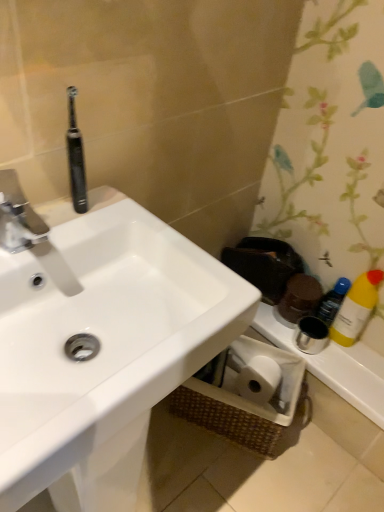
Where is `blue plastic bottle at lower right`? This screenshot has width=384, height=512. blue plastic bottle at lower right is located at coordinates (332, 301).

Where is `yellow plastic bottle at right`? yellow plastic bottle at right is located at coordinates (356, 308).

Where is `blue plastic bottle at lower right`? The image size is (384, 512). blue plastic bottle at lower right is located at coordinates (332, 301).

Does yellow plastic bottle at right appear on the left side of blue plastic bottle at lower right?

No.

Find the location of a particular element. The image size is (384, 512). bottle below the yellow plastic bottle at right (from a real-world perspective) is located at coordinates [x=332, y=301].

Considering the relative sizes of yellow plastic bottle at right and blue plastic bottle at lower right in the image provided, is yellow plastic bottle at right thinner than blue plastic bottle at lower right?

No, yellow plastic bottle at right is not thinner than blue plastic bottle at lower right.

From a real-world perspective, which object rests below the other?

blue plastic bottle at lower right is physically lower.

From the image's perspective, is white glossy sink at upper left located above or below blue plastic bottle at lower right?

white glossy sink at upper left is situated lower than blue plastic bottle at lower right in the image.

From a real-world perspective, which object stands above the other?

white glossy sink at upper left.

Considering the sizes of objects white glossy sink at upper left and blue plastic bottle at lower right in the image provided, who is shorter, white glossy sink at upper left or blue plastic bottle at lower right?

blue plastic bottle at lower right is shorter.

In terms of width, does white glossy sink at upper left look wider or thinner when compared to blue plastic bottle at lower right?

white glossy sink at upper left is wider than blue plastic bottle at lower right.

Between point (345, 376) and point (86, 197), which one is positioned behind?

The point (345, 376) is farther.

Which of these two, white plastic toilet paper holder at lower right or black rubber toothbrush at upper left, is smaller?

black rubber toothbrush at upper left is smaller.

Where is `counter top that is under the black rubber toothbrush at upper left (from a real-world perspective)`? The image size is (384, 512). counter top that is under the black rubber toothbrush at upper left (from a real-world perspective) is located at coordinates (335, 366).

From a real-world perspective, is white plastic toilet paper holder at lower right below black rubber toothbrush at upper left?

Yes, from a real-world perspective, white plastic toilet paper holder at lower right is beneath black rubber toothbrush at upper left.

Considering the relative sizes of white plastic toilet paper holder at lower right and yellow plastic bottle at right in the image provided, is white plastic toilet paper holder at lower right bigger than yellow plastic bottle at right?

Indeed, white plastic toilet paper holder at lower right has a larger size compared to yellow plastic bottle at right.

Considering the sizes of objects white plastic toilet paper holder at lower right and yellow plastic bottle at right in the image provided, who is taller, white plastic toilet paper holder at lower right or yellow plastic bottle at right?

yellow plastic bottle at right is taller.

Considering the positions of objects white plastic toilet paper holder at lower right and yellow plastic bottle at right in the image provided, who is more to the left, white plastic toilet paper holder at lower right or yellow plastic bottle at right?

white plastic toilet paper holder at lower right.

Which object is more forward, yellow plastic bottle at right or silver metallic faucet at upper left?

silver metallic faucet at upper left is more forward.

Is point (354, 341) closer or farther from the camera than point (54, 262)?

Point (354, 341) is positioned farther from the camera compared to point (54, 262).

Would you say yellow plastic bottle at right is a long distance from silver metallic faucet at upper left?

yellow plastic bottle at right is near silver metallic faucet at upper left, not far away.

Is silver metallic faucet at upper left inside yellow plastic bottle at right?

Definitely not — silver metallic faucet at upper left is not inside yellow plastic bottle at right.

In terms of width, does black rubber toothbrush at upper left look wider or thinner when compared to yellow plastic bottle at right?

black rubber toothbrush at upper left is thinner than yellow plastic bottle at right.

Is black rubber toothbrush at upper left oriented towards yellow plastic bottle at right?

No, black rubber toothbrush at upper left does not turn towards yellow plastic bottle at right.

Considering the sizes of black rubber toothbrush at upper left and yellow plastic bottle at right in the image, is black rubber toothbrush at upper left bigger or smaller than yellow plastic bottle at right?

In the image, black rubber toothbrush at upper left appears to be smaller than yellow plastic bottle at right.

Is blue plastic bottle at lower right with black rubber toothbrush at upper left?

blue plastic bottle at lower right and black rubber toothbrush at upper left are clearly separated.

Consider the image. Considering the positions of objects blue plastic bottle at lower right and black rubber toothbrush at upper left in the image provided, who is behind, blue plastic bottle at lower right or black rubber toothbrush at upper left?

blue plastic bottle at lower right.

Considering the relative positions of blue plastic bottle at lower right and black rubber toothbrush at upper left in the image provided, is blue plastic bottle at lower right to the left of black rubber toothbrush at upper left from the viewer's perspective?

No.

Where is `cleaning product in front of the blue plastic bottle at lower right`? This screenshot has width=384, height=512. cleaning product in front of the blue plastic bottle at lower right is located at coordinates (356, 308).

At what (x,y) coordinates should I click in order to perform the action: click on sink below the blue plastic bottle at lower right (from the image's perspective). Please return your answer as a coordinate pair (x, y). Image resolution: width=384 pixels, height=512 pixels. Looking at the image, I should click on (102, 350).

From the image, which object appears to be farther from white plastic toilet paper holder at lower right, white glossy sink at upper left or silver metallic faucet at upper left?

Among the two, silver metallic faucet at upper left is located further to white plastic toilet paper holder at lower right.

From the image, which object appears to be farther from white glossy sink at upper left, blue plastic bottle at lower right or black rubber toothbrush at upper left?

The object further to white glossy sink at upper left is blue plastic bottle at lower right.

When comparing their distances from black rubber toothbrush at upper left, does white glossy sink at upper left or blue plastic bottle at lower right seem closer?

Based on the image, white glossy sink at upper left appears to be nearer to black rubber toothbrush at upper left.

Based on their spatial positions, is blue plastic bottle at lower right or white plastic toilet paper holder at lower right further from black rubber toothbrush at upper left?

white plastic toilet paper holder at lower right is positioned further to the anchor black rubber toothbrush at upper left.

Based on their spatial positions, is white plastic toilet paper holder at lower right or blue plastic bottle at lower right further from silver metallic faucet at upper left?

blue plastic bottle at lower right is positioned further to the anchor silver metallic faucet at upper left.

Estimate the real-world distances between objects in this image. Which object is further from yellow plastic bottle at right, white plastic toilet paper holder at lower right or silver metallic faucet at upper left?

silver metallic faucet at upper left is positioned further to the anchor yellow plastic bottle at right.

Estimate the real-world distances between objects in this image. Which object is further from white glossy sink at upper left, white plastic toilet paper holder at lower right or yellow plastic bottle at right?

yellow plastic bottle at right is positioned further to the anchor white glossy sink at upper left.

When comparing their distances from white plastic toilet paper holder at lower right, does yellow plastic bottle at right or silver metallic faucet at upper left seem closer?

yellow plastic bottle at right lies closer to white plastic toilet paper holder at lower right than the other object.

Locate an element on the screen. This screenshot has height=512, width=384. plumbing fixture located between white glossy sink at upper left and blue plastic bottle at lower right in the depth direction is located at coordinates (31, 233).

Locate an element on the screen. The height and width of the screenshot is (512, 384). toothbrush located between white glossy sink at upper left and white plastic toilet paper holder at lower right in the left-right direction is located at coordinates (76, 157).

Identify the location of cleaning product between white glossy sink at upper left and blue plastic bottle at lower right from front to back. This screenshot has width=384, height=512. (356, 308).

Find the location of `counter top between silver metallic faucet at upper left and yellow plastic bottle at right from left to right`. counter top between silver metallic faucet at upper left and yellow plastic bottle at right from left to right is located at coordinates (335, 366).